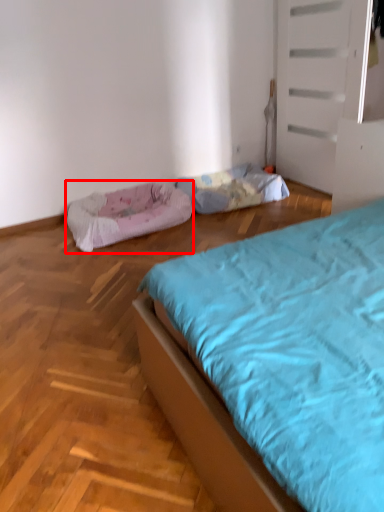
Question: From the image's perspective, where is dog bed (annotated by the red box) located relative to blanket?

Choices:
 (A) below
 (B) above

Answer: (A)